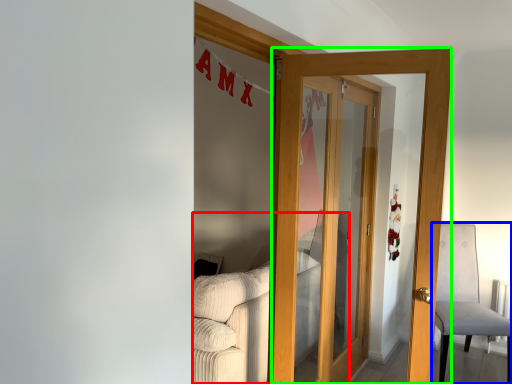
Question: Which is nearer to the couch (highlighted by a red box)? chair (highlighted by a blue box) or door (highlighted by a green box).

Choices:
 (A) chair
 (B) door

Answer: (B)